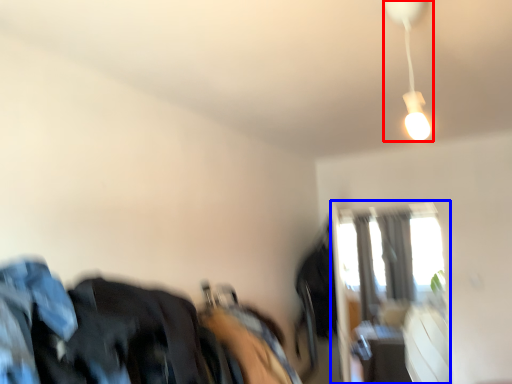
Question: Which of the following is the farthest to the observer, lamp (highlighted by a red box) or window (highlighted by a blue box)?

Choices:
 (A) lamp
 (B) window

Answer: (B)